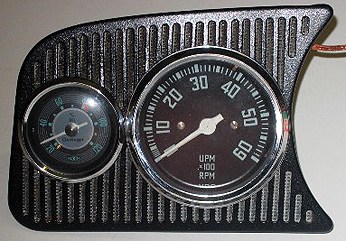
Where is `white surface`? This screenshot has width=346, height=241. white surface is located at coordinates (328, 169).